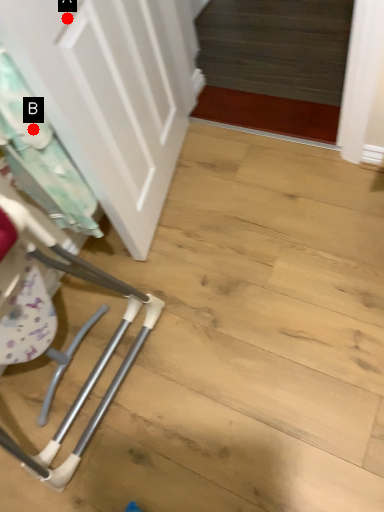
Question: Two points are circled on the image, labeled by A and B beside each circle. Which point is further to the camera?

Choices:
 (A) A is further
 (B) B is further

Answer: (A)